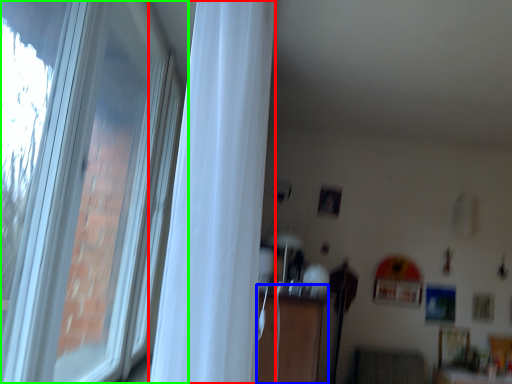
Question: Which object is the farthest from curtain (highlighted by a red box)? Choose among these: dresser (highlighted by a blue box) or window (highlighted by a green box).

Choices:
 (A) dresser
 (B) window

Answer: (A)